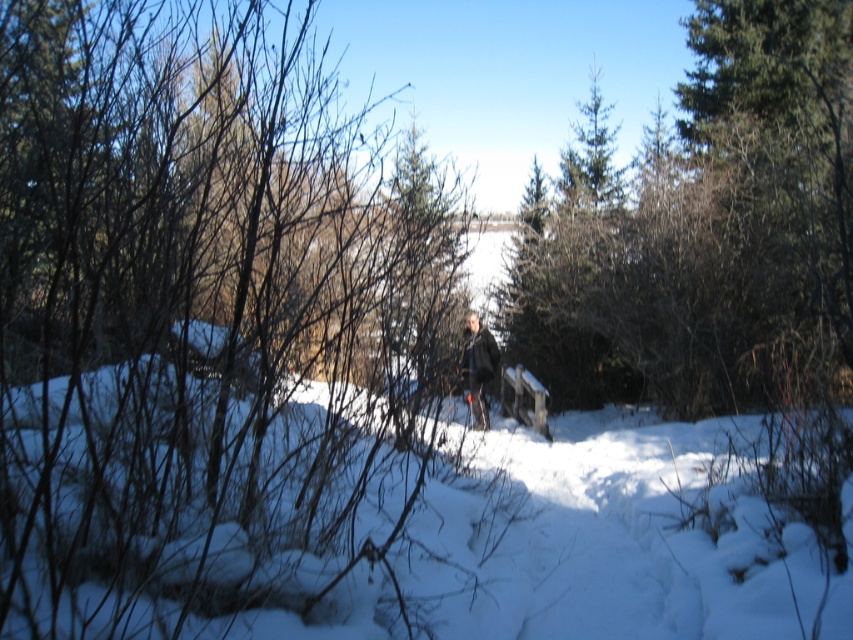
Is point (608, 387) farther from viewer compared to point (482, 371)?

Yes, it is behind point (482, 371).

This screenshot has width=853, height=640. What do you see at coordinates (706, 230) in the screenshot?
I see `green leafy tree at center` at bounding box center [706, 230].

Find the location of a particular element. The width and height of the screenshot is (853, 640). green leafy tree at center is located at coordinates (706, 230).

In the scene shown: Between white fluffy snow at center and green leafy tree at center, which one has less height?

With less height is green leafy tree at center.

Can you confirm if white fluffy snow at center is positioned to the right of green leafy tree at center?

No, white fluffy snow at center is not to the right of green leafy tree at center.

Image resolution: width=853 pixels, height=640 pixels. What do you see at coordinates (413, 518) in the screenshot? I see `white fluffy snow at center` at bounding box center [413, 518].

The image size is (853, 640). What are the coordinates of `white fluffy snow at center` in the screenshot? It's located at (413, 518).

Does green leafy tree at center come in front of green textured pine tree at upper center?

Yes, it is in front of green textured pine tree at upper center.

Is green leafy tree at center above green textured pine tree at upper center?

Yes.

Which is in front, point (589, 362) or point (608, 112)?

Point (589, 362)

Locate an element on the screen. This screenshot has height=640, width=853. green leafy tree at center is located at coordinates (706, 230).